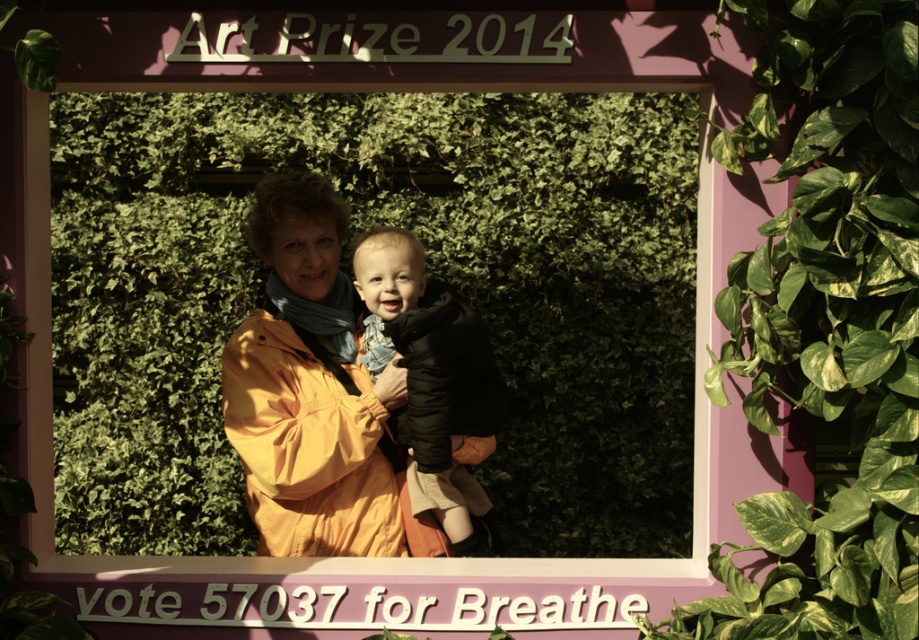
Question: Is green leafy plant at right further to camera compared to soft black puffer jacket at center?

Choices:
 (A) no
 (B) yes

Answer: (A)

Question: Which object is positioned closest to the soft black puffer jacket at center?

Choices:
 (A) green leafy plant at center
 (B) green leafy plant at right

Answer: (B)

Question: Does green leafy plant at right appear on the right side of matte yellow jacket at center?

Choices:
 (A) no
 (B) yes

Answer: (B)

Question: Can you confirm if green leafy plant at right is positioned above matte yellow jacket at center?

Choices:
 (A) yes
 (B) no

Answer: (A)

Question: Among these points, which one is nearest to the camera?

Choices:
 (A) (222, 266)
 (B) (271, 326)
 (C) (456, 472)

Answer: (B)

Question: Which point is farther from the camera taking this photo?

Choices:
 (A) (222, 403)
 (B) (71, 164)
 (C) (395, 269)
 (D) (883, 259)

Answer: (B)